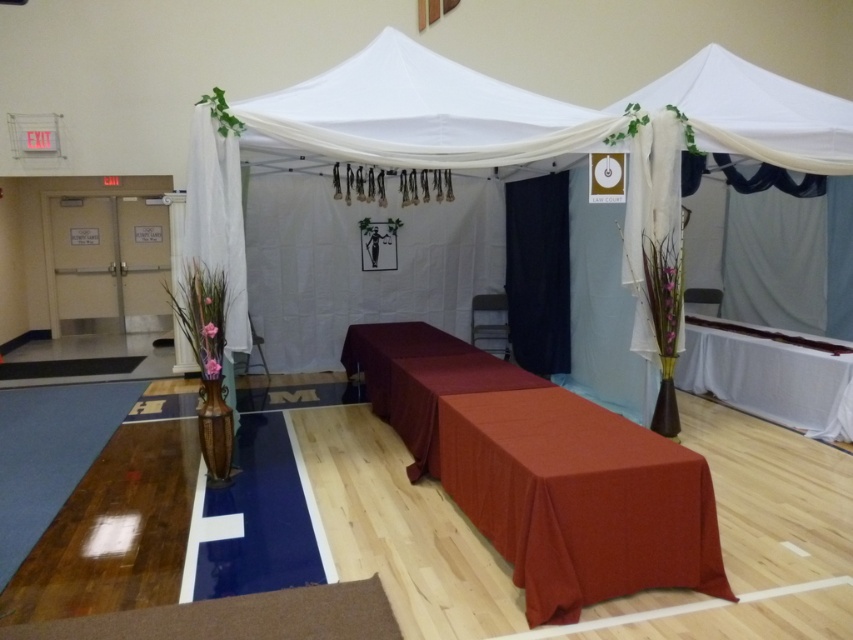
Does point (729, 67) come farther from viewer compared to point (183, 609)?

Yes, it is behind point (183, 609).

This screenshot has height=640, width=853. Describe the element at coordinates (512, 138) in the screenshot. I see `white fabric tent at center` at that location.

Image resolution: width=853 pixels, height=640 pixels. What do you see at coordinates (512, 138) in the screenshot? I see `white fabric tent at center` at bounding box center [512, 138].

What are the coordinates of `white fabric tent at center` in the screenshot? It's located at (512, 138).

Does white fabric tent at center have a smaller size compared to white sheer curtain at left?

Incorrect, white fabric tent at center is not smaller in size than white sheer curtain at left.

Is point (447, 128) positioned after point (225, 317)?

Yes, point (447, 128) is farther from viewer.

The image size is (853, 640). Find the location of `white fabric tent at center`. white fabric tent at center is located at coordinates (512, 138).

Between matte red tablecloth at center and smooth white table at right, which one appears on the left side from the viewer's perspective?

Positioned to the left is matte red tablecloth at center.

Image resolution: width=853 pixels, height=640 pixels. Identify the location of matte red tablecloth at center. (578, 499).